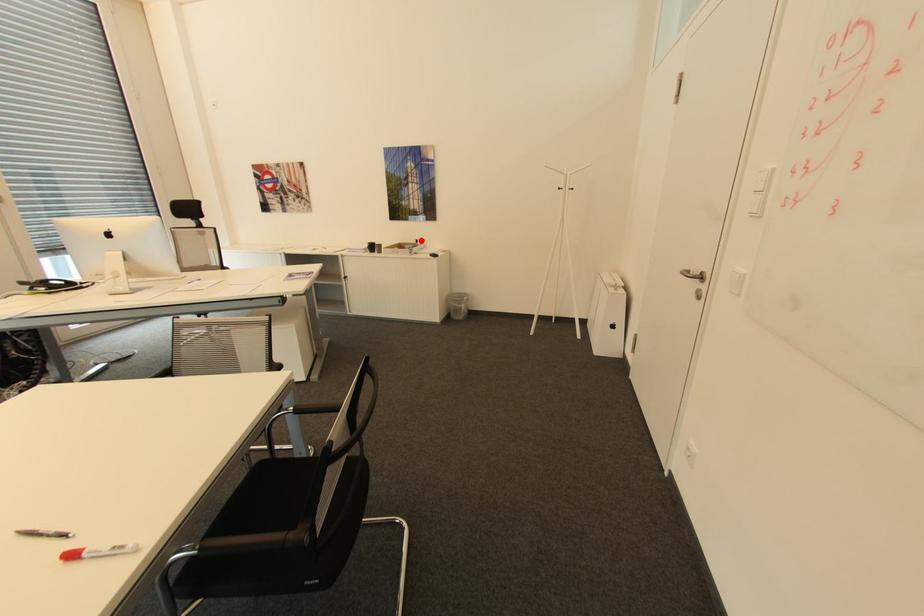
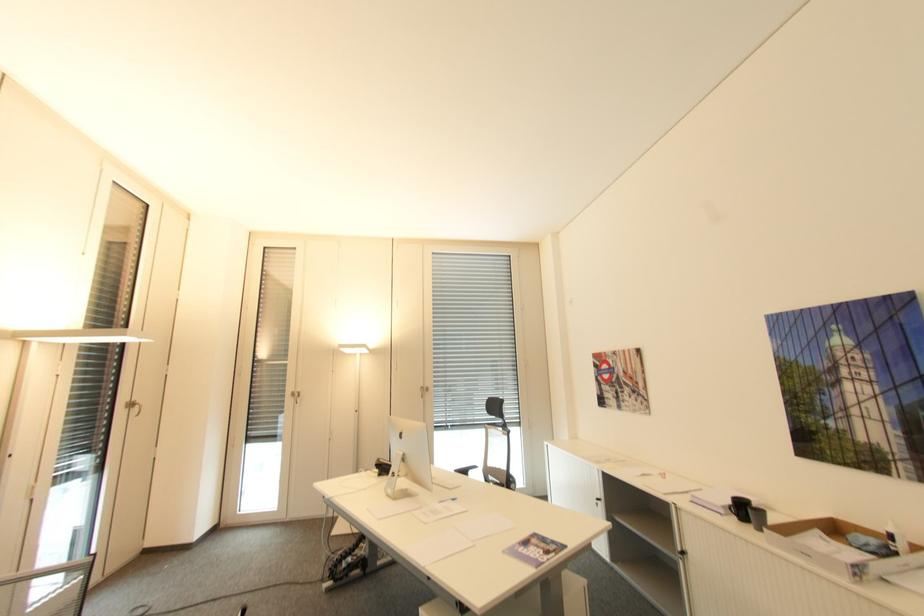
The point at the highlighted location is marked in the first image. Where is the corresponding point in the second image?

(895, 537)